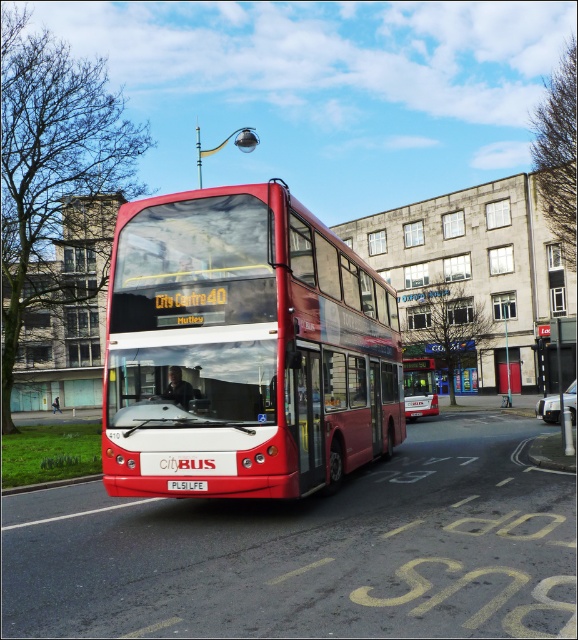
Question: Considering the relative positions of shiny red bus at center and white plastic license plate at center in the image provided, where is shiny red bus at center located with respect to white plastic license plate at center?

Choices:
 (A) right
 (B) left

Answer: (A)

Question: Which point is farther to the camera?

Choices:
 (A) (572, 392)
 (B) (406, 410)
 (C) (195, 486)

Answer: (B)

Question: Observing the image, what is the correct spatial positioning of metallic silver car at center in reference to white plastic license plate at center?

Choices:
 (A) below
 (B) above

Answer: (A)

Question: Does shiny red bus at center appear under metallic silver car at center?

Choices:
 (A) yes
 (B) no

Answer: (B)

Question: Which point appears closest to the camera in this image?

Choices:
 (A) (570, 401)
 (B) (172, 486)
 (C) (436, 410)
 (D) (347, 452)

Answer: (B)

Question: Which point is farther to the camera?

Choices:
 (A) pos(420,404)
 (B) pos(164,227)
 (C) pos(544,410)
 (D) pos(195,484)

Answer: (A)